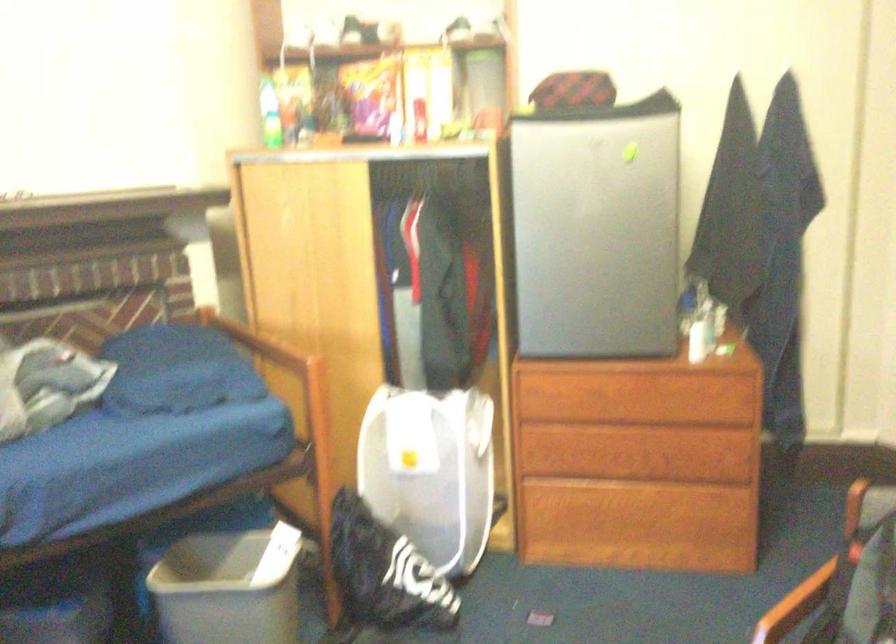
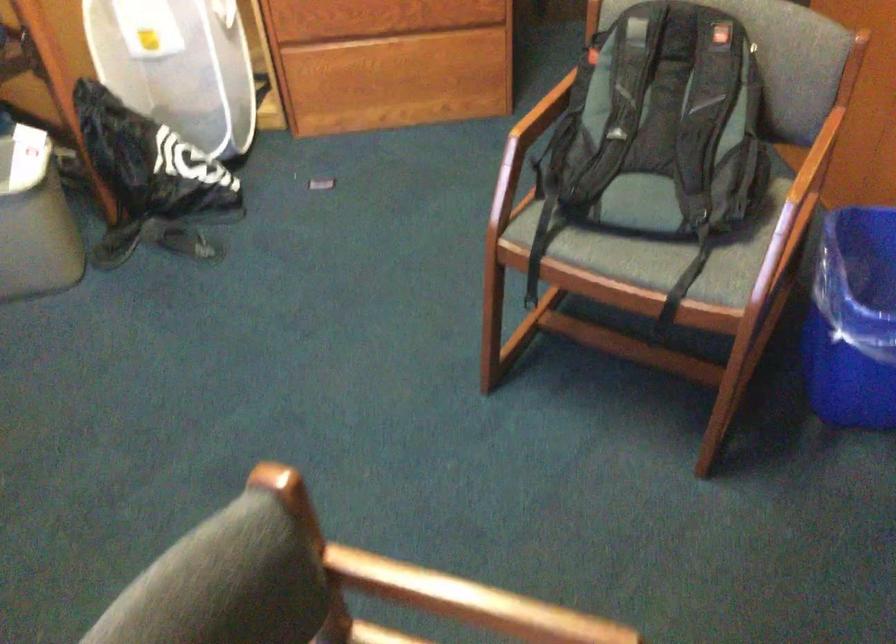
Question: How did the camera likely rotate?

Choices:
 (A) Left
 (B) Right
 (C) Up
 (D) Down

Answer: (D)